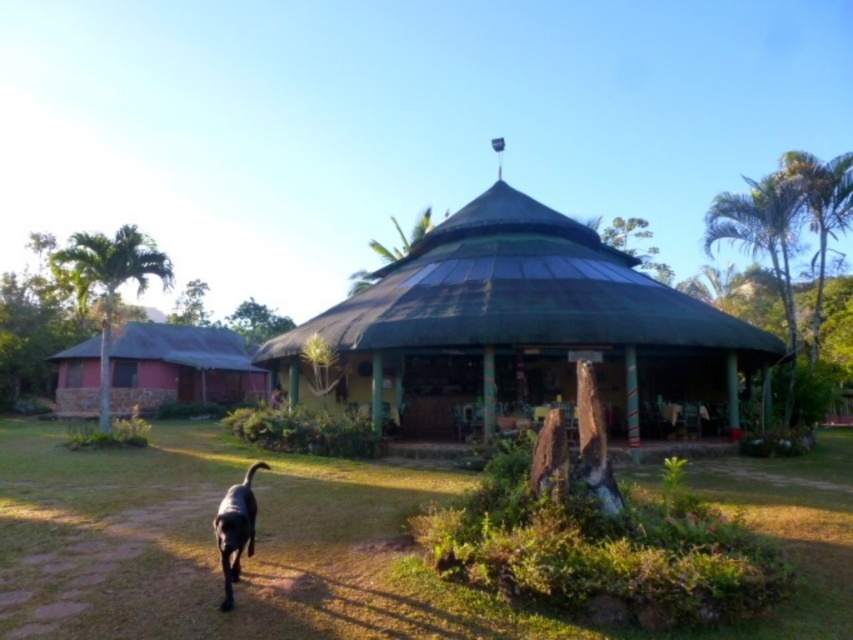
You are standing at the entrance of the green thatched roof gazebo at center. You want to walk to the point marked at coordinates [520,332]. Is this point located on the gazebo itself or somewhere else?

The point marked at coordinates [520,332] is on the green thatched roof gazebo at center, so it is located on the gazebo itself.

You are standing at the entrance of the pavilion and want to walk towards the green grass at center. Which direction should you walk to avoid passing by the matte red hut at left?

Since the green grass at center is closer to the viewer than the matte red hut at left, you should walk straight ahead towards the green grass at center. The matte red hut at left is farther away, so you won not pass by it on your path.